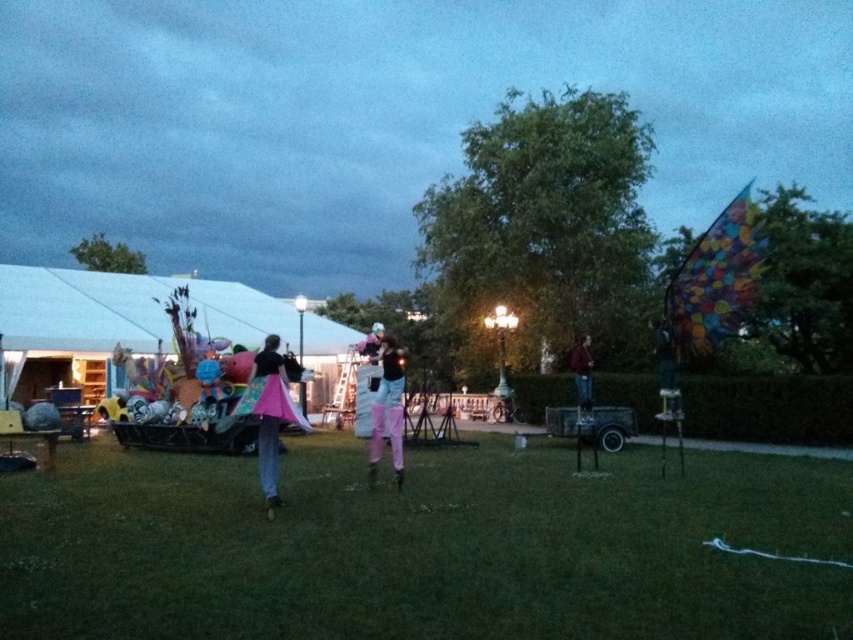
In the scene shown: You are a photographer trying to capture the scene. You want to ensure the multicolored fabric kite at upper right and the dark blue jeans at center are both in focus. Given that your camera can only focus on objects within a 2 meter width range, can you achieve this?

The multicolored fabric kite at upper right is wider than the dark blue jeans at center. However, the exact distance between them isn

What is the location of the point at coordinates [119,320] in the image?

The point at coordinates [119,320] is located on the white fabric tent at left.